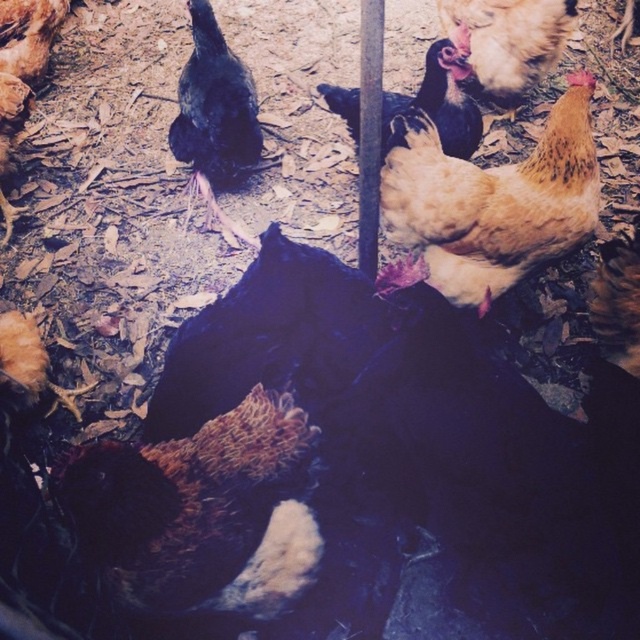
The image size is (640, 640). I want to click on brown speckled feathers at center, so click(x=200, y=512).

Who is taller, brown speckled feathers at center or black matte chicken at upper left?

With more height is brown speckled feathers at center.

Between point (134, 564) and point (6, 45), which one is positioned in front?

Point (134, 564) is more forward.

I want to click on brown speckled feathers at center, so click(x=200, y=512).

Measure the distance between point (493, 83) and camera.

The distance of point (493, 83) from camera is 3.80 meters.

Does brown speckled chicken at upper right have a smaller size compared to brown speckled chicken at lower left?

No, brown speckled chicken at upper right is not smaller than brown speckled chicken at lower left.

Is point (547, 68) behind point (1, 321)?

Yes, point (547, 68) is farther from viewer.

Identify the location of brown speckled chicken at upper right. This screenshot has width=640, height=640. (508, 42).

Which of these two, black feathered chicken at center or brown textured chicken at center, stands shorter?

Standing shorter between the two is brown textured chicken at center.

Can you confirm if black feathered chicken at center is taller than brown textured chicken at center?

Yes.

Which is in front, point (209, 26) or point (429, 80)?

Point (429, 80) is in front.

At what (x,y) coordinates should I click in order to perform the action: click on black feathered chicken at center. Please return your answer as a coordinate pair (x, y). The height and width of the screenshot is (640, 640). Looking at the image, I should click on (214, 115).